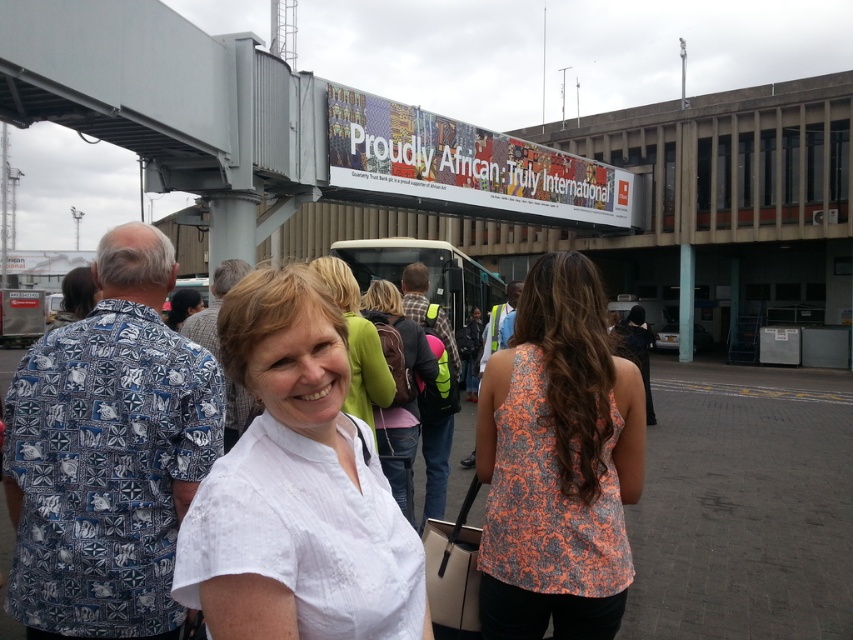
Does point (148, 3) lie behind point (409, 323)?

Yes, it is.

The height and width of the screenshot is (640, 853). Describe the element at coordinates (244, 116) in the screenshot. I see `metallic gray overpass at upper center` at that location.

Is point (465, 188) farther from camera compared to point (383, 460)?

Yes.

The height and width of the screenshot is (640, 853). Find the location of `metallic gray overpass at upper center`. metallic gray overpass at upper center is located at coordinates (244, 116).

Does point (248, 584) lie behind point (558, 564)?

That is False.

Is white cotton shirt at center shorter than orange-patterned fabric top at center?

Correct, white cotton shirt at center is not as tall as orange-patterned fabric top at center.

Is point (221, 314) closer to camera compared to point (537, 481)?

Yes.

The image size is (853, 640). Find the location of `white cotton shirt at center`. white cotton shirt at center is located at coordinates (297, 488).

Based on the photo, can you confirm if orange-patterned fabric top at center is wider than green fabric backpack at center?

Indeed, orange-patterned fabric top at center has a greater width compared to green fabric backpack at center.

Looking at this image, is orange-patterned fabric top at center above green fabric backpack at center?

Correct, orange-patterned fabric top at center is located above green fabric backpack at center.

Measure the distance between point [587,595] and camera.

2.41 meters

The image size is (853, 640). What are the coordinates of `orange-patterned fabric top at center` in the screenshot? It's located at (556, 461).